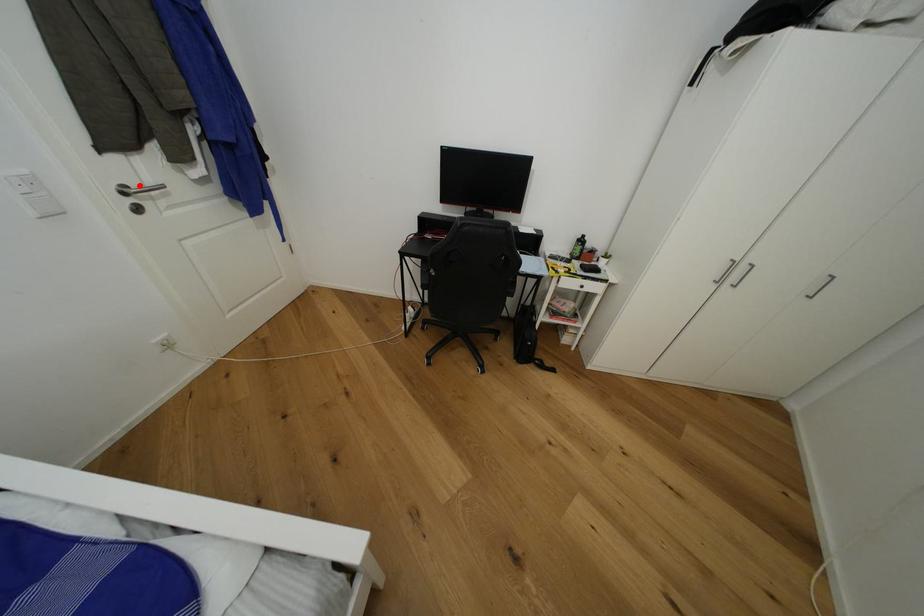
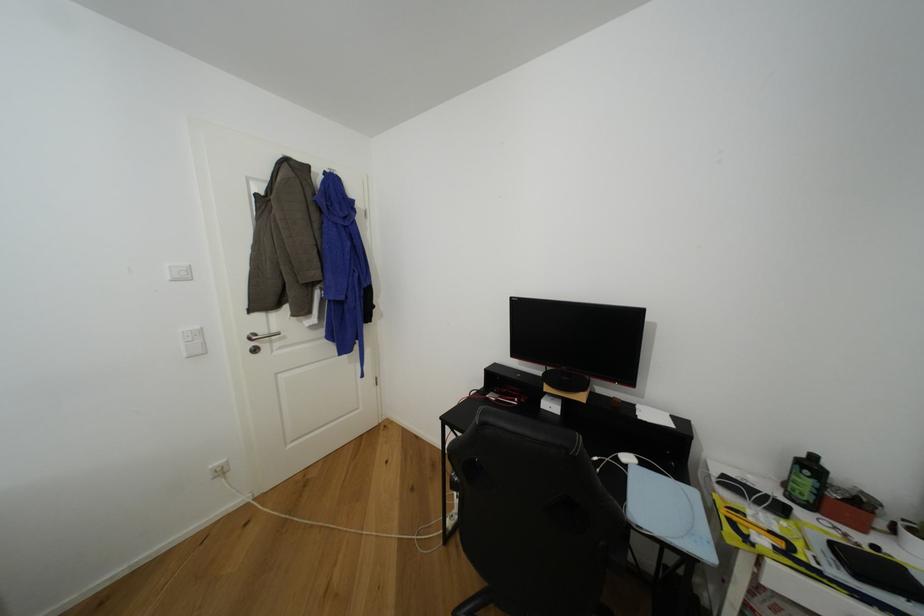
Where in the second image is the point corresponding to the highlighted location from the first image?

(268, 334)